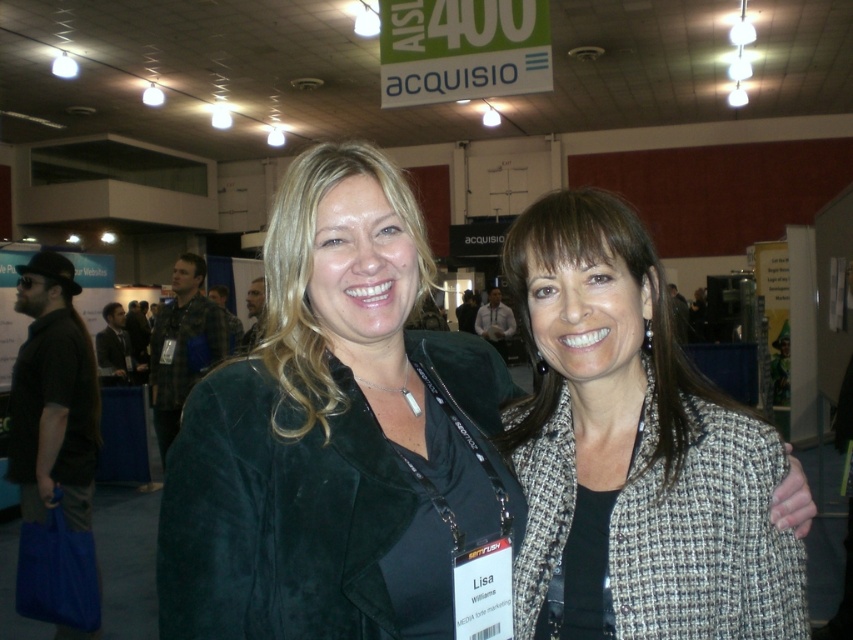
You are at a convention and need to take a photo of the point at coordinates (221,484). Your camera has a focal length of 35mm and you are currently 32.48 inches away from the point. Is the point in focus if the depth of field at 35mm covers up to 30 inches?

The distance between you and the point is 32.48 inches, which exceeds the depth of field coverage of 30 inches. Therefore, the point at coordinates (221,484) will not be in focus.

Looking at this image, you are standing in the convention hall and want to take a photo of the velvet black jacket at center. If your camera can focus on objects within 30 inches, will it be able to capture the jacket clearly?

The velvet black jacket at center is 31.03 inches away from the viewer, which is slightly beyond the camera focus range of 30 inches. Therefore, the camera may not be able to capture the jacket clearly.

You are a photographer at the event and need to capture a closeup shot of both the velvet black jacket at center and the gray tweed blazer at center without any part of them being cut off. The camera frame can only accommodate objects within a 7 inch width. Is this possible?

The velvet black jacket at center is 7.78 inches away from the gray tweed blazer at center. Since the distance between them exceeds the camera frame capacity of 7 inches, capturing both without cropping is not possible.